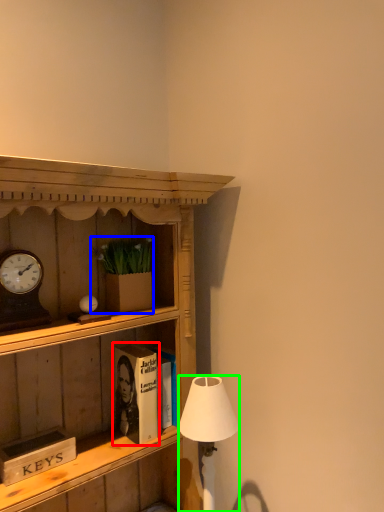
Question: Estimate the real-world distances between objects in this image. Which object is closer to book (highlighted by a red box), houseplant (highlighted by a blue box) or lamp (highlighted by a green box)?

Choices:
 (A) houseplant
 (B) lamp

Answer: (B)